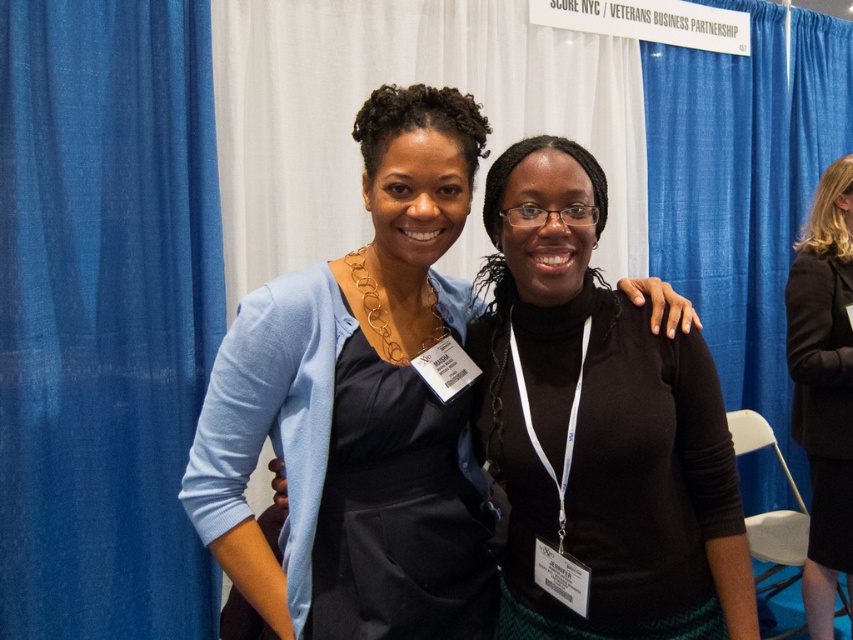
Question: Does matte blue cardigan at center have a lesser width compared to dark brown wool coat at right?

Choices:
 (A) yes
 (B) no

Answer: (A)

Question: Which is farther from the dark brown wool coat at right?

Choices:
 (A) blue fabric curtain at left
 (B) matte blue cardigan at center

Answer: (A)

Question: Which object appears closest to the camera in this image?

Choices:
 (A) matte blue cardigan at center
 (B) blue fabric curtain at left

Answer: (A)

Question: Where is blue fabric curtain at left located in relation to matte blue cardigan at center in the image?

Choices:
 (A) right
 (B) left

Answer: (B)

Question: Can you confirm if blue fabric curtain at left is positioned above matte blue cardigan at center?

Choices:
 (A) yes
 (B) no

Answer: (A)

Question: Estimate the real-world distances between objects in this image. Which object is closer to the blue fabric curtain at left?

Choices:
 (A) matte blue cardigan at center
 (B) dark brown wool coat at right

Answer: (A)